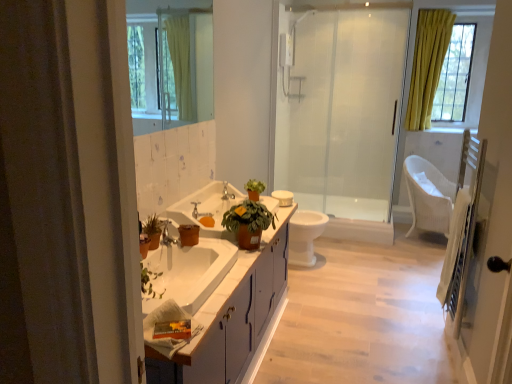
Question: Is white plastic towel bar at upper center spatially inside yellow fabric curtain at upper right, or outside of it?

Choices:
 (A) outside
 (B) inside

Answer: (A)

Question: Is point (303, 77) positioned closer to the camera than point (440, 77)?

Choices:
 (A) closer
 (B) farther

Answer: (A)

Question: Which object is positioned farthest from the white glossy sink at center?

Choices:
 (A) transparent glass shower door at center
 (B) brushed metal faucet at center
 (C) white glossy cabinet at center
 (D) white glossy toilet bowl at center
 (E) matte silver faucet at center, the second tap viewed from the right

Answer: (A)

Question: Considering the real-world distances, which object is closest to the matte silver faucet at center, the second tap viewed from the right?

Choices:
 (A) clear glass mirror at upper center
 (B) white plastic towel bar at upper center
 (C) white glossy toilet bowl at center
 (D) silver metallic tap at center, placed as the 2th tap when sorted from front to back
 (E) yellow fabric curtain at upper right

Answer: (D)